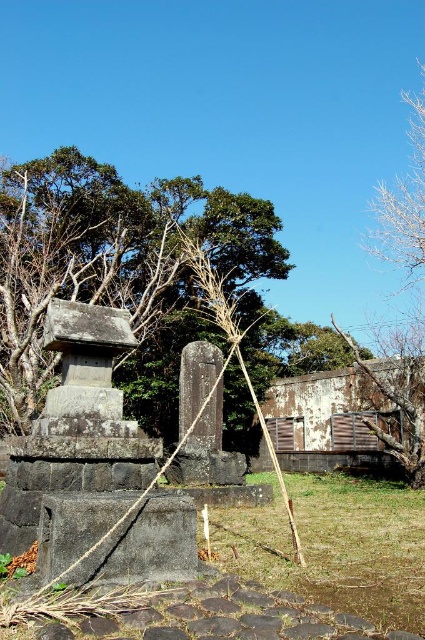
You are standing in front of the stone structure and want to walk towards the bare wood tree at right. Which direction should you face to move directly towards it without passing by the green leafy tree at upper center?

You should face towards the right side of the bare wood tree at right since the green leafy tree at upper center is positioned on the left side of it, so facing the right side will avoid passing by the green leafy tree at upper center.

You are standing at the point marked by the coordinates point (108, 257) in the image. Looking around, you see the stone structure described in the scene. Which direction should you face to see the green leafy tree at upper center?

You should face north because the point (108, 257) is at upper center, indicating the green leafy tree at upper center is directly in front of you.

You are standing in the outdoor scene and want to walk to the green grass at lower center. Is the green leafy tree at upper center blocking your path?

The green grass at lower center is behind the green leafy tree at upper center, so the tree is blocking the path to the green grass at lower center.